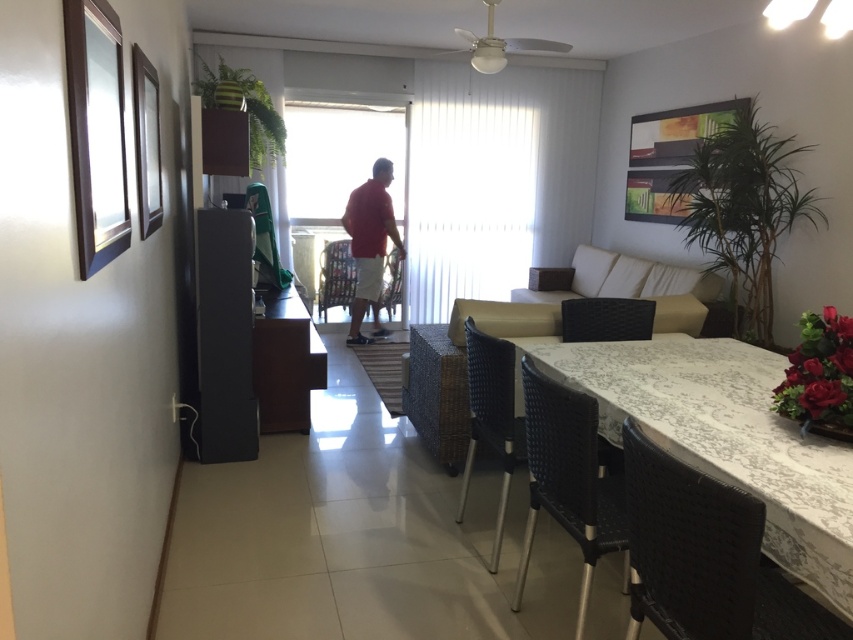
Question: Which object is the closest to the woven black chair at center?

Choices:
 (A) woven black chair at lower right
 (B) red matte shirt at center
 (C) black woven chair at lower right
 (D) matte black chair at center

Answer: (C)

Question: Considering the relative positions of white textured table at lower right and matte plastic chair at center in the image provided, where is white textured table at lower right located with respect to matte plastic chair at center?

Choices:
 (A) below
 (B) above

Answer: (A)

Question: Which is nearer to the black woven chair at center?

Choices:
 (A) woven black chair at center
 (B) matte black chair at center

Answer: (A)

Question: Does woven black chair at lower right have a larger size compared to red matte shirt at center?

Choices:
 (A) yes
 (B) no

Answer: (B)

Question: Which point appears closest to the camera in this image?

Choices:
 (A) tap(387, 285)
 (B) tap(563, 449)
 (C) tap(509, 394)

Answer: (B)

Question: Can you confirm if white textured table at lower right is positioned to the left of woven black chair at lower right?

Choices:
 (A) yes
 (B) no

Answer: (B)